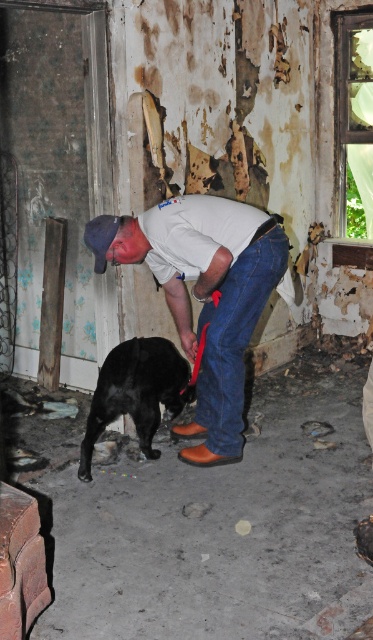
Question: Does white matte shirt at center appear over black matte dog at lower left?

Choices:
 (A) yes
 (B) no

Answer: (A)

Question: Is white matte shirt at center in front of black matte dog at lower left?

Choices:
 (A) no
 (B) yes

Answer: (B)

Question: Among these objects, which one is farthest from the camera?

Choices:
 (A) black matte dog at lower left
 (B) white matte shirt at center

Answer: (A)

Question: Which of the following is the farthest from the observer?

Choices:
 (A) white matte shirt at center
 (B) black matte dog at lower left

Answer: (B)

Question: From the image, what is the correct spatial relationship of white matte shirt at center in relation to black matte dog at lower left?

Choices:
 (A) right
 (B) left

Answer: (A)